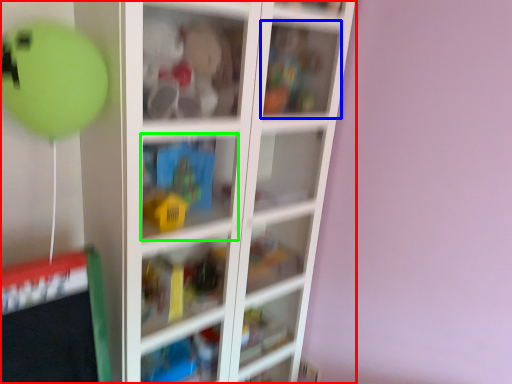
Question: Which is nearer to the shelf (highlighted by a red box)? cabinet (highlighted by a blue box) or cabinet (highlighted by a green box).

Choices:
 (A) cabinet
 (B) cabinet

Answer: (B)